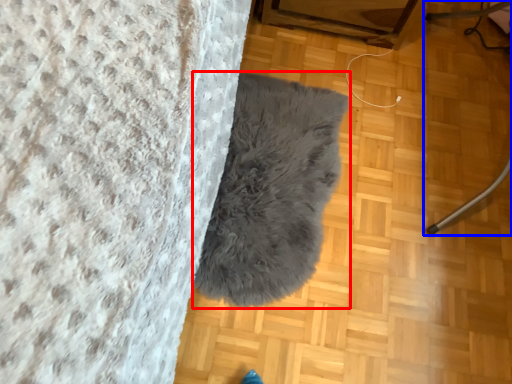
Question: Which of the following is the farthest to the observer, blanket (highlighted by a red box) or furniture (highlighted by a blue box)?

Choices:
 (A) blanket
 (B) furniture

Answer: (A)